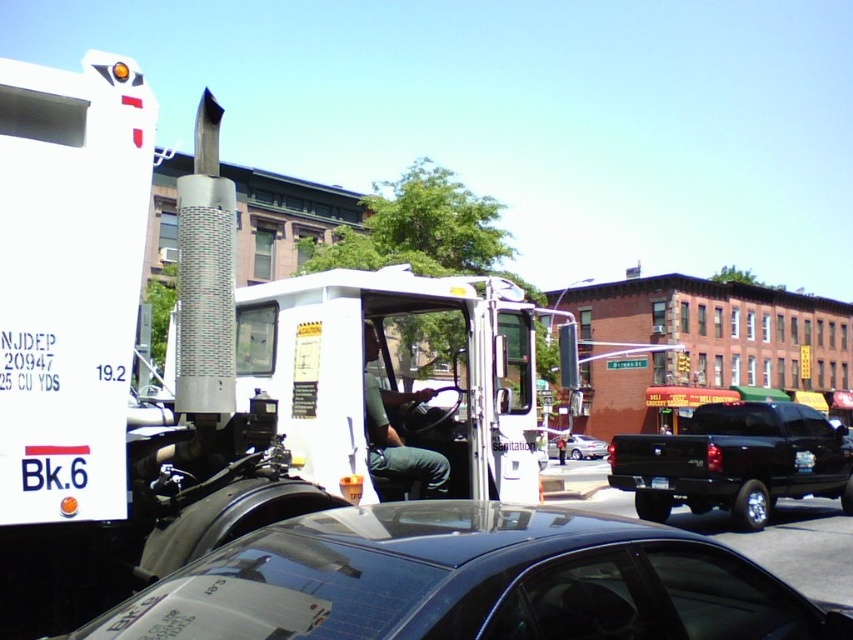
Question: From the image, what is the correct spatial relationship of black matte truck at right in relation to shiny silver sedan at center?

Choices:
 (A) right
 (B) left

Answer: (A)

Question: Is black matte truck at right above shiny silver sedan at center?

Choices:
 (A) yes
 (B) no

Answer: (A)

Question: Does glossy black car at center have a greater width compared to black matte truck at right?

Choices:
 (A) no
 (B) yes

Answer: (A)

Question: Which of the following is the closest to the observer?

Choices:
 (A) (573, 456)
 (B) (244, 560)

Answer: (B)

Question: Which of these objects is positioned farthest from the black matte truck at right?

Choices:
 (A) glossy black car at center
 (B) shiny silver sedan at center

Answer: (A)

Question: Which object is the closest to the black matte truck at right?

Choices:
 (A) glossy black car at center
 (B) shiny silver sedan at center

Answer: (B)